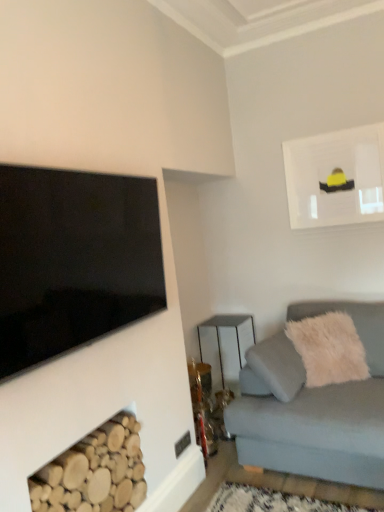
Question: Does matte white picture frame at upper right have a lesser width compared to light gray fabric couch at lower right?

Choices:
 (A) no
 (B) yes

Answer: (B)

Question: Does matte white picture frame at upper right have a larger size compared to light gray fabric couch at lower right?

Choices:
 (A) yes
 (B) no

Answer: (B)

Question: Is there a large distance between matte white picture frame at upper right and light gray fabric couch at lower right?

Choices:
 (A) no
 (B) yes

Answer: (B)

Question: From the image's perspective, would you say matte white picture frame at upper right is positioned over light gray fabric couch at lower right?

Choices:
 (A) yes
 (B) no

Answer: (A)

Question: From a real-world perspective, is matte white picture frame at upper right over light gray fabric couch at lower right?

Choices:
 (A) no
 (B) yes

Answer: (B)

Question: Looking at their shapes, would you say matte white picture frame at upper right is wider or thinner than light gray fabric couch at lower right?

Choices:
 (A) thin
 (B) wide

Answer: (A)

Question: From a real-world perspective, is matte white picture frame at upper right above or below light gray fabric couch at lower right?

Choices:
 (A) above
 (B) below

Answer: (A)

Question: Is matte white picture frame at upper right taller or shorter than light gray fabric couch at lower right?

Choices:
 (A) short
 (B) tall

Answer: (A)

Question: From the image's perspective, is matte white picture frame at upper right positioned above or below light gray fabric couch at lower right?

Choices:
 (A) below
 (B) above

Answer: (B)

Question: From a real-world perspective, is matte white picture frame at upper right physically located above or below metallic silver table at center?

Choices:
 (A) above
 (B) below

Answer: (A)

Question: Would you say matte white picture frame at upper right is to the left or to the right of metallic silver table at center in the picture?

Choices:
 (A) left
 (B) right

Answer: (B)

Question: Based on their sizes in the image, would you say matte white picture frame at upper right is bigger or smaller than metallic silver table at center?

Choices:
 (A) small
 (B) big

Answer: (A)

Question: Considering the positions of point (289, 144) and point (223, 322), is point (289, 144) closer or farther from the camera than point (223, 322)?

Choices:
 (A) closer
 (B) farther

Answer: (A)

Question: Choose the correct answer: Is matte white picture frame at upper right inside black glossy tv at upper left or outside it?

Choices:
 (A) inside
 (B) outside

Answer: (B)

Question: Is matte white picture frame at upper right to the left or to the right of black glossy tv at upper left in the image?

Choices:
 (A) left
 (B) right

Answer: (B)